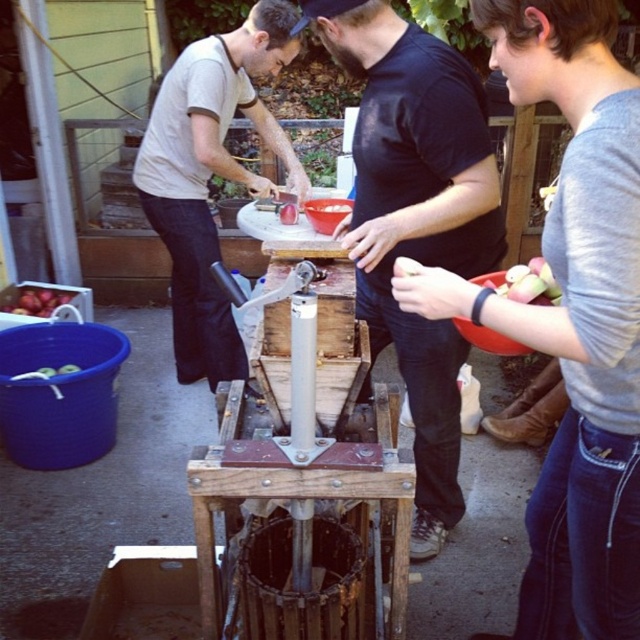
Between black matte shirt at center and matte red apples at left, which one has more height?

Standing taller between the two is black matte shirt at center.

Where is `black matte shirt at center`? black matte shirt at center is located at coordinates (416, 218).

Does gray cotton shirt at upper right lie behind black matte shirt at center?

No.

Can you confirm if gray cotton shirt at upper right is shorter than black matte shirt at center?

Indeed, gray cotton shirt at upper right has a lesser height compared to black matte shirt at center.

You are a GUI agent. You are given a task and a screenshot of the screen. Output one action in this format:
    pyautogui.click(x=<x>, y=<y>)
    Task: Click on the gray cotton shirt at upper right
    
    Given the screenshot: What is the action you would take?
    pyautogui.click(x=572, y=317)

Is matte white shirt at upper left below matte red apples at left?

Actually, matte white shirt at upper left is above matte red apples at left.

Can you confirm if matte white shirt at upper left is bigger than matte red apples at left?

Yes.

Who is more distant from viewer, (157, 109) or (49, 304)?

Point (49, 304)

This screenshot has width=640, height=640. I want to click on matte white shirt at upper left, so click(209, 176).